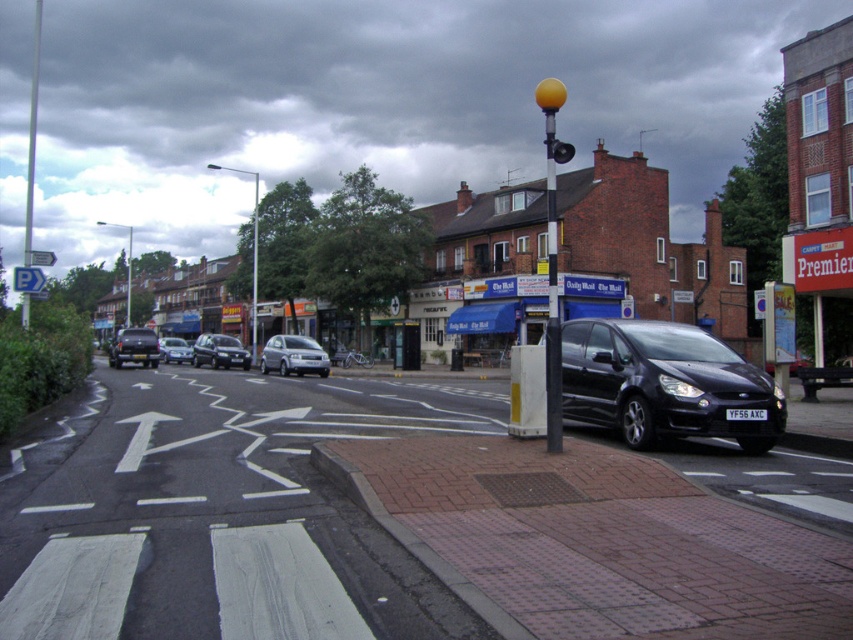
Question: Which of the following is the farthest from the observer?

Choices:
 (A) (175, 355)
 (B) (233, 344)

Answer: (A)

Question: Among these objects, which one is nearest to the camera?

Choices:
 (A) metallic pole at center
 (B) brushed metal pole at center
 (C) satin silver car at center
 (D) matte silver car at center

Answer: (C)

Question: In this image, where is satin silver car at center located relative to shiny black car at center-left?

Choices:
 (A) right
 (B) left

Answer: (A)

Question: Does matte black car at center appear under yellow rubber traffic light at center?

Choices:
 (A) no
 (B) yes

Answer: (B)

Question: Does metallic pole at center have a greater width compared to yellow matte traffic light at upper center?

Choices:
 (A) yes
 (B) no

Answer: (A)

Question: Which object is the farthest from the matte black car at center?

Choices:
 (A) satin silver car at center
 (B) matte silver car at center
 (C) yellow rubber traffic light at center
 (D) brushed metal pole at center

Answer: (C)